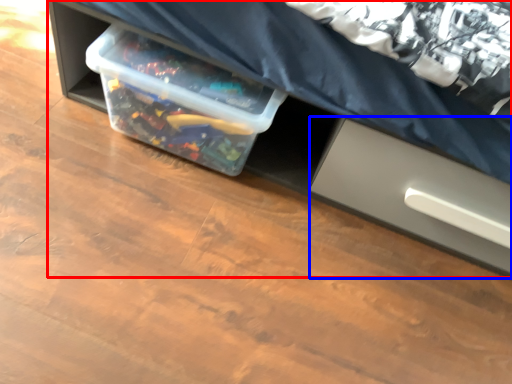
Question: Which object appears farthest to the camera in this image, furniture (highlighted by a red box) or drawer (highlighted by a blue box)?

Choices:
 (A) furniture
 (B) drawer

Answer: (B)